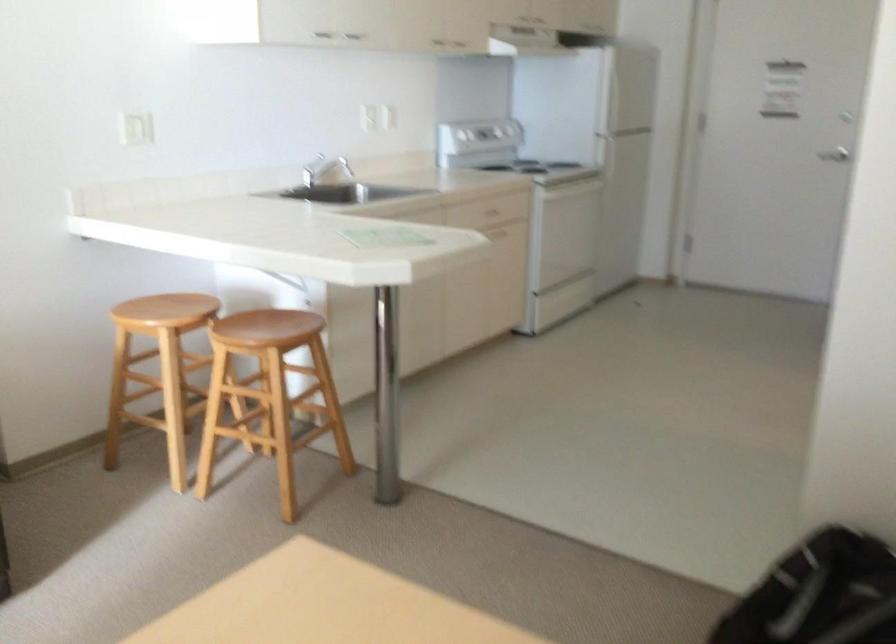
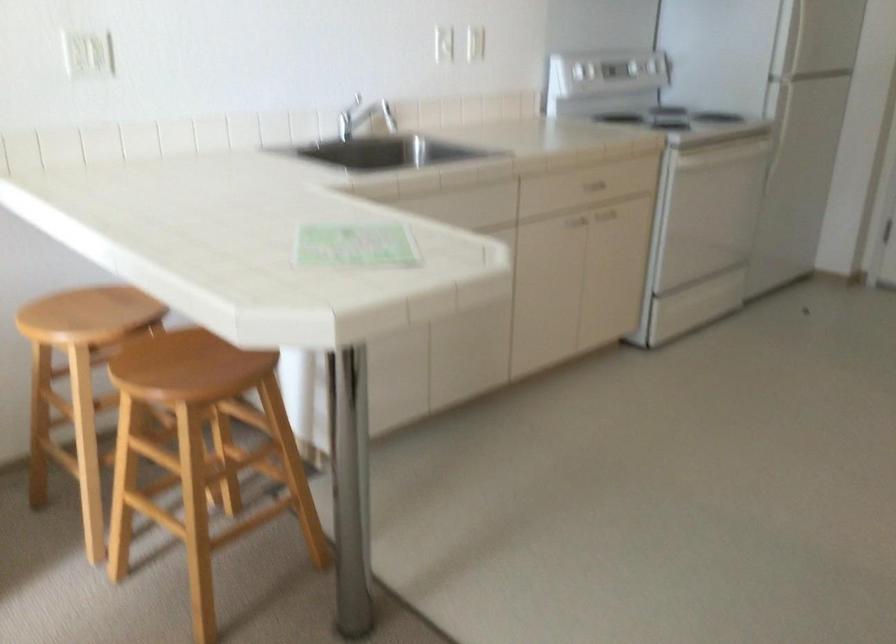
The point at (268, 323) is marked in the first image. Where is the corresponding point in the second image?

(197, 357)